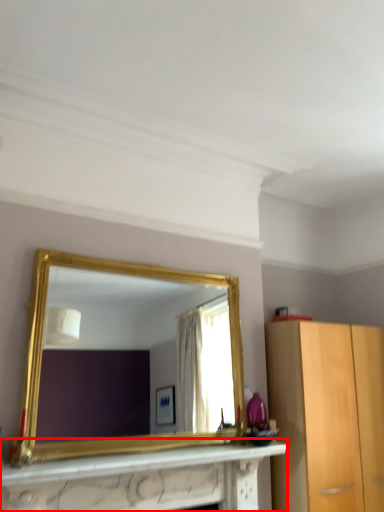
Question: From the image's perspective, where is vanity (annotated by the red box) located relative to mirror?

Choices:
 (A) below
 (B) above

Answer: (A)